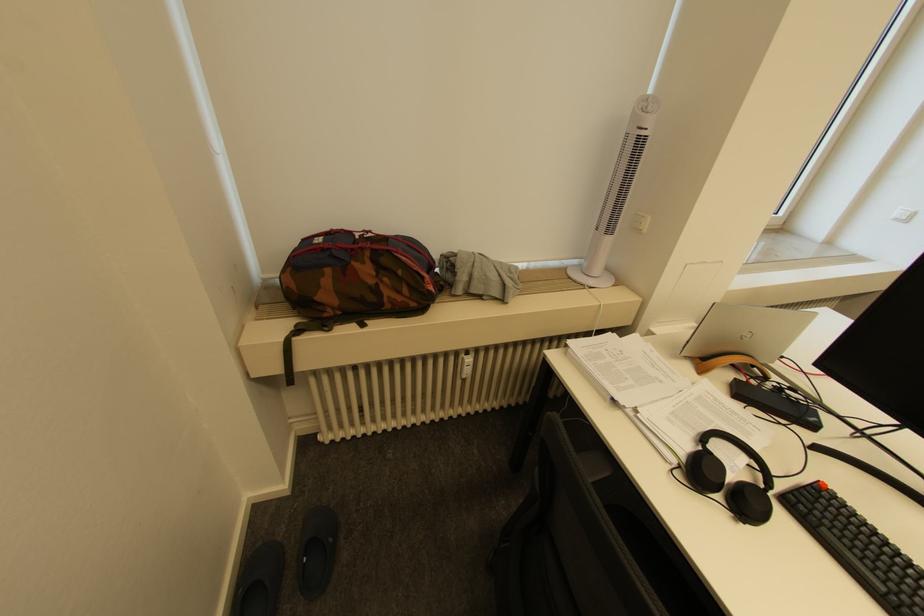
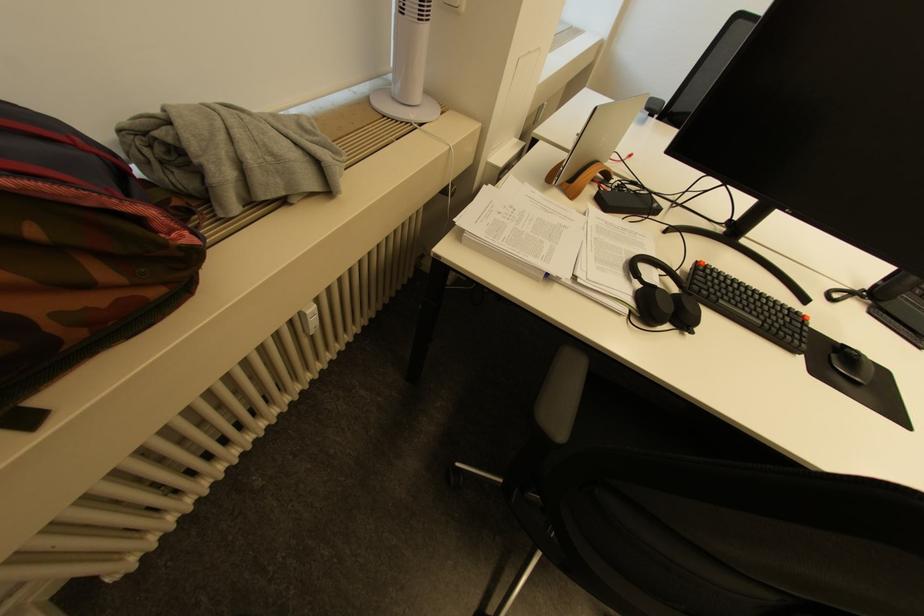
Where in the second image is the point corresponding to the point at 438,288 from the first image?

(196, 238)